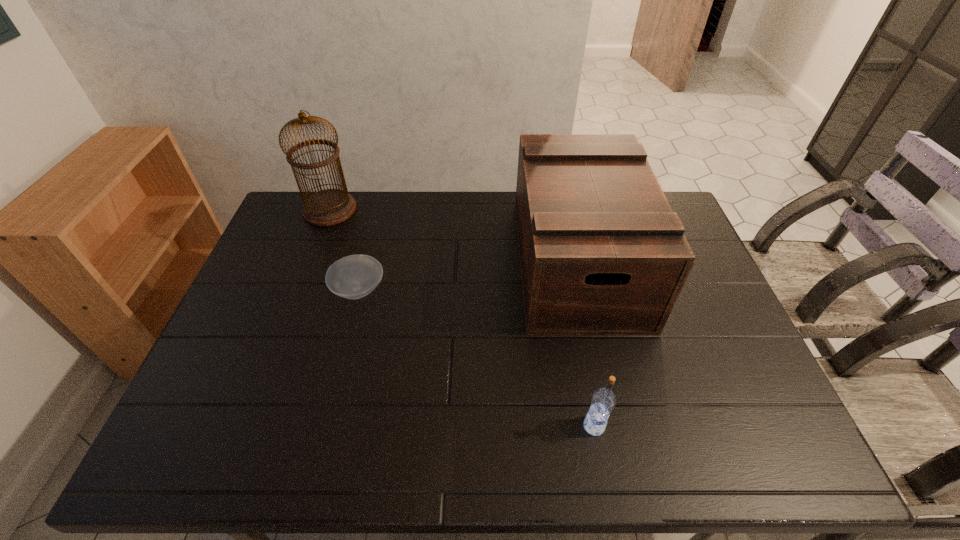
At what (x,y) coordinates should I click in order to perform the action: click on free space that satisfies the following two spatial constraints: 1. on the front-facing side of the tallest object; 2. on the back side of the bowl. Please return your answer as a coordinate pair (x, y). This screenshot has height=540, width=960. Looking at the image, I should click on (x=299, y=290).

At what (x,y) coordinates should I click in order to perform the action: click on vacant space that satisfies the following two spatial constraints: 1. on the front-facing side of the leftmost object; 2. on the right side of the second object from left to right. Please return your answer as a coordinate pair (x, y). Looking at the image, I should click on (299, 290).

Identify the location of vacant space that satisfies the following two spatial constraints: 1. on the front-facing side of the birdcage; 2. on the back side of the second tallest object. (309, 262).

You are a GUI agent. You are given a task and a screenshot of the screen. Output one action in this format:
    pyautogui.click(x=<x>, y=<y>)
    Task: Click on the free space that satisfies the following two spatial constraints: 1. on the front-facing side of the shortest object; 2. on the left side of the birdcage
    This screenshot has height=540, width=960.
    Given the screenshot: What is the action you would take?
    pyautogui.click(x=299, y=290)

Find the location of a particular element. vacant space that satisfies the following two spatial constraints: 1. on the front-facing side of the birdcage; 2. on the left side of the third tallest object is located at coordinates (246, 426).

Locate an element on the screen. The width and height of the screenshot is (960, 540). free spot that satisfies the following two spatial constraints: 1. on the front-facing side of the third object from right to left; 2. on the left side of the tallest object is located at coordinates (299, 290).